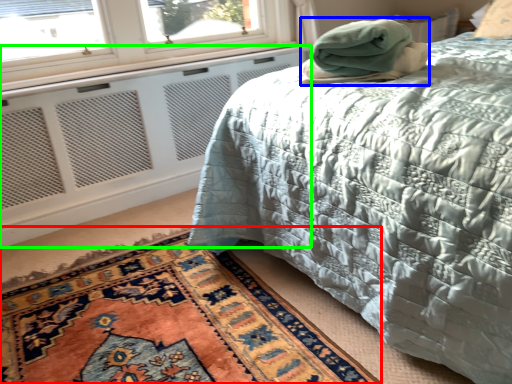
Question: Which object is positioned closest to mat (highlighted by a red box)? Select from blanket (highlighted by a blue box) and radiator (highlighted by a green box).

Choices:
 (A) blanket
 (B) radiator

Answer: (A)